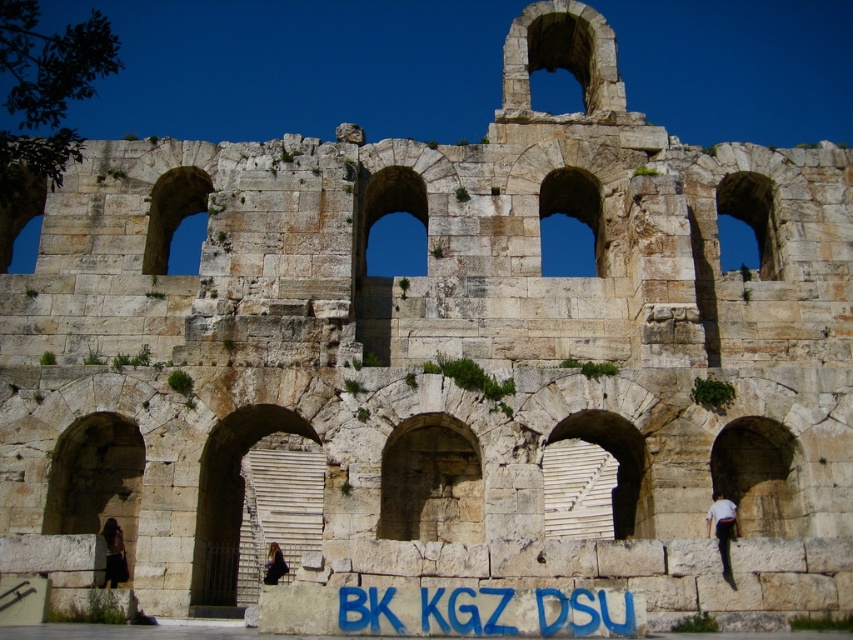
Question: Which point is closer to the camera taking this photo?

Choices:
 (A) (264, 566)
 (B) (709, 518)

Answer: (B)

Question: Is blue paint graffiti at center to the left of dark brown leather jacket at lower left from the viewer's perspective?

Choices:
 (A) no
 (B) yes

Answer: (A)

Question: Can you confirm if white fabric at right is smaller than dark brown leather jacket at lower left?

Choices:
 (A) no
 (B) yes

Answer: (A)

Question: Which of the following is the farthest from the observer?

Choices:
 (A) (267, 570)
 (B) (717, 531)

Answer: (A)

Question: In this image, where is white fabric at right located relative to dark brown leather jacket at lower left?

Choices:
 (A) below
 (B) above

Answer: (B)

Question: Which of these objects is positioned farthest from the dark brown leather jacket at lower left?

Choices:
 (A) white fabric at right
 (B) blue paint graffiti at center

Answer: (A)